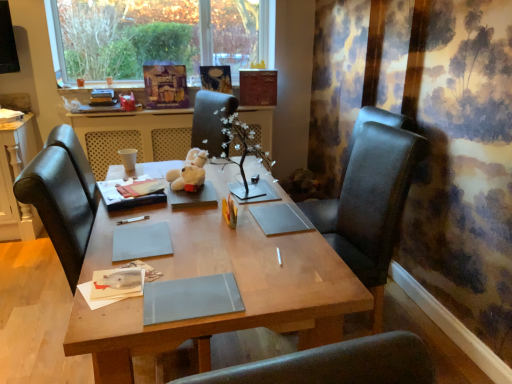
Image resolution: width=512 pixels, height=384 pixels. I want to click on empty space that is to the right of white plush bear at center, so click(221, 184).